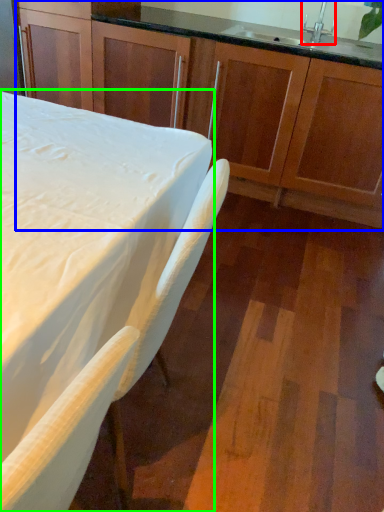
Question: Which is farther away from faucet (highlighted by a red box)? cabinetry (highlighted by a blue box) or table (highlighted by a green box)?

Choices:
 (A) cabinetry
 (B) table

Answer: (B)